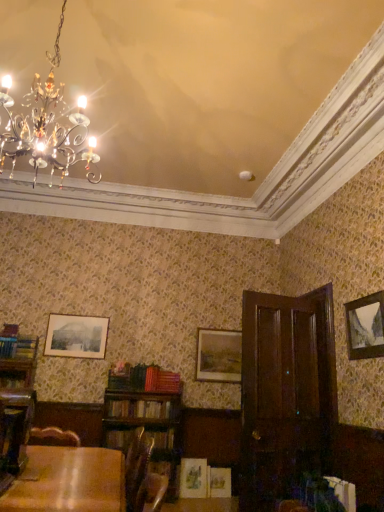
Question: Is wooden table at lower left shorter than hardcover book at center, which is the third book in back-to-front order?

Choices:
 (A) yes
 (B) no

Answer: (B)

Question: Is wooden table at lower left not within hardcover book at center, the 3th book viewed from the right?

Choices:
 (A) yes
 (B) no

Answer: (A)

Question: Is hardcover book at center, the 3th book viewed from the right, surrounded by wooden table at lower left?

Choices:
 (A) no
 (B) yes

Answer: (A)

Question: Can you confirm if wooden table at lower left is bigger than hardcover book at center, which is the third book in back-to-front order?

Choices:
 (A) yes
 (B) no

Answer: (A)

Question: From the image's perspective, does wooden table at lower left appear lower than hardcover book at center, which is the third book in back-to-front order?

Choices:
 (A) yes
 (B) no

Answer: (B)

Question: From the image's perspective, is wooden table at lower left on hardcover book at center, which is the third book in back-to-front order?

Choices:
 (A) yes
 (B) no

Answer: (A)

Question: Considering the relative positions of white paper book at lower right, arranged as the fourth book when viewed from the back, and dark wood armoire at right in the image provided, is white paper book at lower right, arranged as the fourth book when viewed from the back, to the left of dark wood armoire at right from the viewer's perspective?

Choices:
 (A) yes
 (B) no

Answer: (B)

Question: Can you confirm if white paper book at lower right, which is the 1th book in front-to-back order, is smaller than dark wood armoire at right?

Choices:
 (A) no
 (B) yes

Answer: (B)

Question: Is the depth of white paper book at lower right, which is the 1th book in front-to-back order, less than that of dark wood armoire at right?

Choices:
 (A) yes
 (B) no

Answer: (A)

Question: Is white paper book at lower right, which is counted as the 1th book, starting from the right, further to the viewer compared to dark wood armoire at right?

Choices:
 (A) yes
 (B) no

Answer: (B)

Question: Considering the relative sizes of white paper book at lower right, arranged as the fourth book when viewed from the back, and dark wood armoire at right in the image provided, is white paper book at lower right, arranged as the fourth book when viewed from the back, taller than dark wood armoire at right?

Choices:
 (A) no
 (B) yes

Answer: (A)

Question: Considering the relative sizes of white paper book at lower right, which is the 4th book in left-to-right order, and dark wood armoire at right in the image provided, is white paper book at lower right, which is the 4th book in left-to-right order, wider than dark wood armoire at right?

Choices:
 (A) yes
 (B) no

Answer: (B)

Question: Does white paper book at lower right, which is the 4th book in left-to-right order, appear on the right side of hardcover book at lower left, marked as the third book in a front-to-back arrangement?

Choices:
 (A) yes
 (B) no

Answer: (A)